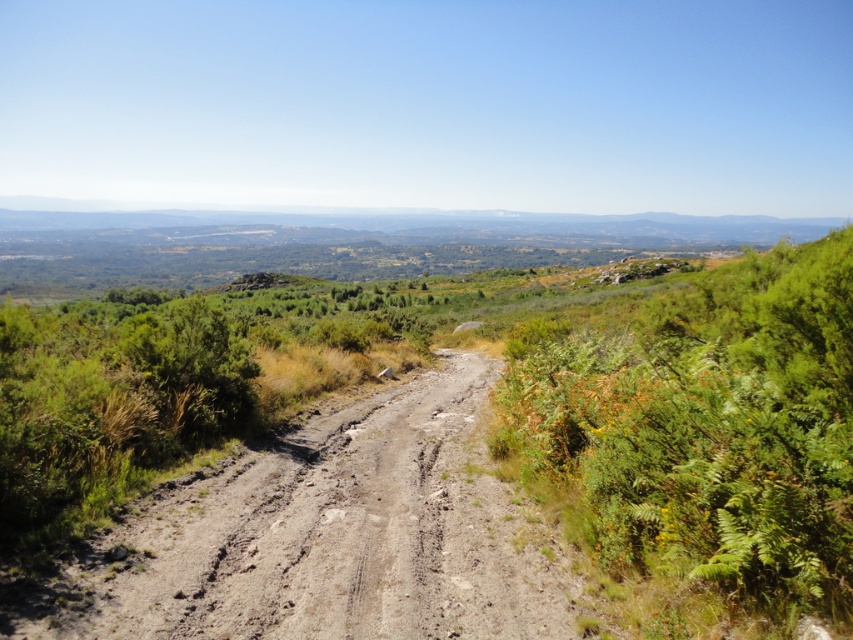
Consider the image. How much distance is there between green leafy shrubs at right and brown dirt track at center?

green leafy shrubs at right and brown dirt track at center are 38.10 feet apart from each other.

Can you confirm if green leafy shrubs at right is smaller than brown dirt track at center?

Actually, green leafy shrubs at right might be larger than brown dirt track at center.

Does point (766, 579) come farther from viewer compared to point (210, 502)?

No, (766, 579) is in front of (210, 502).

Where is `green leafy shrubs at right`? Image resolution: width=853 pixels, height=640 pixels. green leafy shrubs at right is located at coordinates (701, 429).